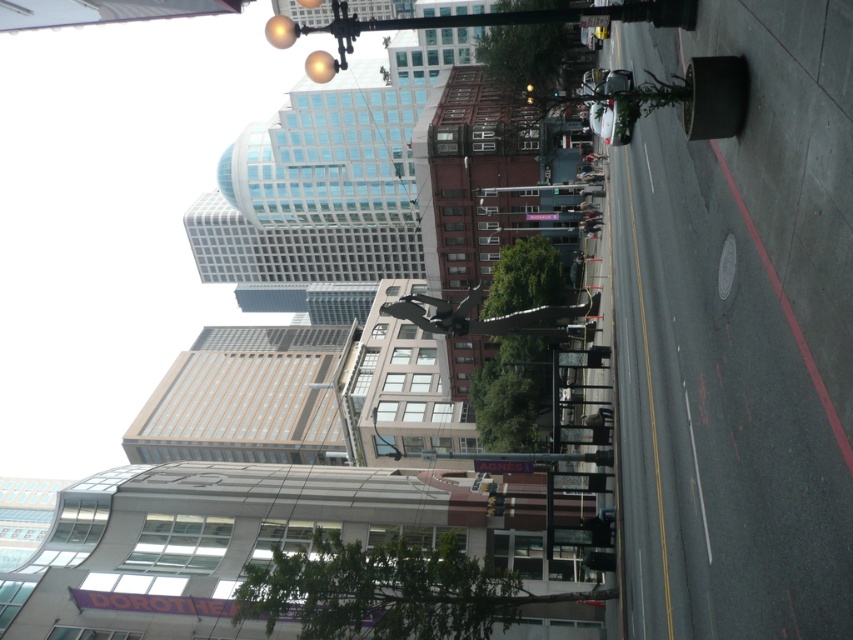
Question: Which point is closer to the camera taking this photo?

Choices:
 (A) (596, 26)
 (B) (503, 502)

Answer: (A)

Question: Is metallic traffic light at center closer to the viewer compared to metallic traffic light at upper center?

Choices:
 (A) no
 (B) yes

Answer: (A)

Question: Can you confirm if metallic traffic light at center is smaller than metallic traffic light at upper center?

Choices:
 (A) no
 (B) yes

Answer: (B)

Question: Which point is closer to the camera taking this photo?

Choices:
 (A) click(496, 515)
 (B) click(595, 28)

Answer: (A)

Question: Does metallic traffic light at center have a lesser width compared to metallic traffic light at upper center?

Choices:
 (A) yes
 (B) no

Answer: (A)